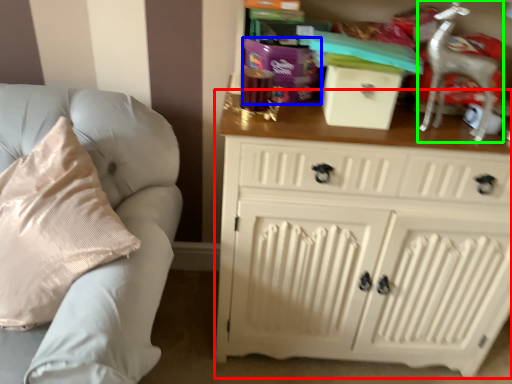
Question: Based on their relative distances, which object is nearer to chest of drawers (highlighted by a red box)? Choose from gift (highlighted by a blue box) and rocking chair (highlighted by a green box).

Choices:
 (A) gift
 (B) rocking chair

Answer: (B)